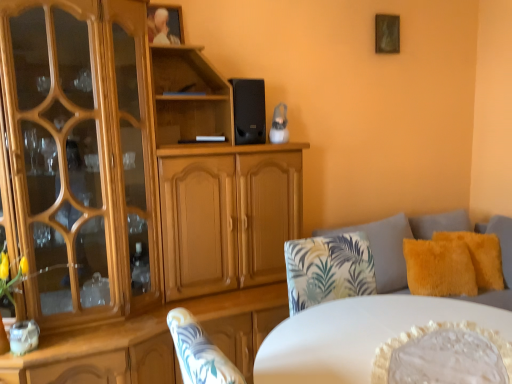
Question: Considering the relative sizes of light brown wood cabinet at center and wooden picture frame at upper center, the 1th picture frame in the front-to-back sequence, in the image provided, is light brown wood cabinet at center bigger than wooden picture frame at upper center, the 1th picture frame in the front-to-back sequence,?

Choices:
 (A) no
 (B) yes

Answer: (B)

Question: Is light brown wood cabinet at center taller than wooden picture frame at upper center, which is counted as the second picture frame, starting from the right?

Choices:
 (A) no
 (B) yes

Answer: (B)

Question: Is light brown wood cabinet at center oriented away from wooden picture frame at upper center, the 1th picture frame in the front-to-back sequence?

Choices:
 (A) yes
 (B) no

Answer: (A)

Question: Does light brown wood cabinet at center have a lesser width compared to wooden picture frame at upper center, the 1th picture frame when ordered from left to right?

Choices:
 (A) yes
 (B) no

Answer: (B)

Question: Is light brown wood cabinet at center further to the viewer compared to wooden picture frame at upper center, the 1th picture frame when ordered from left to right?

Choices:
 (A) no
 (B) yes

Answer: (A)

Question: Based on their positions, is black matte speaker at upper center located to the left or right of wooden picture frame at upper center, the 1th picture frame in the front-to-back sequence?

Choices:
 (A) right
 (B) left

Answer: (A)

Question: From the image's perspective, is black matte speaker at upper center above or below wooden picture frame at upper center, the 1th picture frame in the front-to-back sequence?

Choices:
 (A) below
 (B) above

Answer: (A)

Question: Considering the positions of black matte speaker at upper center and wooden picture frame at upper center, the 1th picture frame when ordered from left to right, in the image, is black matte speaker at upper center bigger or smaller than wooden picture frame at upper center, the 1th picture frame when ordered from left to right,?

Choices:
 (A) big
 (B) small

Answer: (A)

Question: Considering the positions of black matte speaker at upper center and wooden picture frame at upper center, the second picture frame positioned from the back, in the image, is black matte speaker at upper center taller or shorter than wooden picture frame at upper center, the second picture frame positioned from the back,?

Choices:
 (A) short
 (B) tall

Answer: (B)

Question: From a real-world perspective, is wooden picture frame at upper center, the 1th picture frame when ordered from left to right, positioned above or below light brown wood cabinet at center?

Choices:
 (A) above
 (B) below

Answer: (A)

Question: Looking at the image, does wooden picture frame at upper center, which is counted as the second picture frame, starting from the right, seem bigger or smaller compared to light brown wood cabinet at center?

Choices:
 (A) big
 (B) small

Answer: (B)

Question: Is wooden picture frame at upper center, the second picture frame positioned from the back, inside or outside of light brown wood cabinet at center?

Choices:
 (A) inside
 (B) outside

Answer: (A)

Question: Is wooden picture frame at upper center, the second picture frame positioned from the back, taller or shorter than light brown wood cabinet at center?

Choices:
 (A) short
 (B) tall

Answer: (A)

Question: Based on their sizes in the image, would you say black matte speaker at upper center is bigger or smaller than white glossy table at center?

Choices:
 (A) small
 (B) big

Answer: (A)

Question: In terms of width, does black matte speaker at upper center look wider or thinner when compared to white glossy table at center?

Choices:
 (A) thin
 (B) wide

Answer: (A)